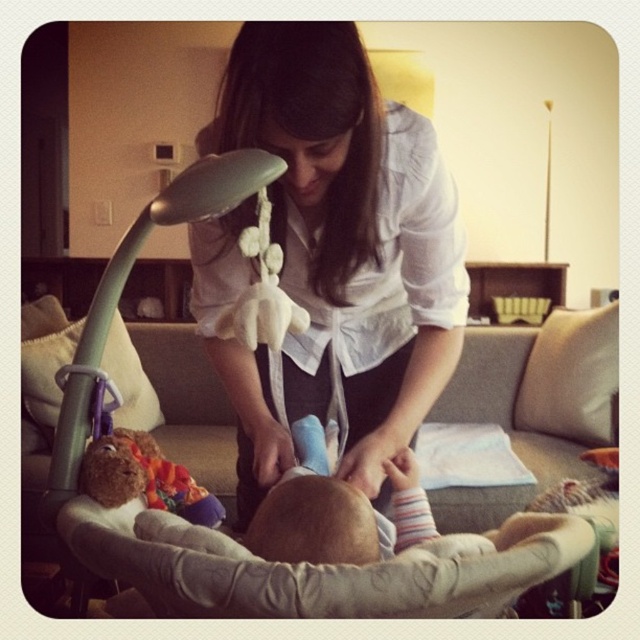
Question: Is white satin blouse at center thinner than gray fabric baby carriage at center?

Choices:
 (A) no
 (B) yes

Answer: (B)

Question: Is white satin blouse at center bigger than brown plush bear at lower left?

Choices:
 (A) yes
 (B) no

Answer: (A)

Question: Which of the following is the closest to the observer?

Choices:
 (A) brown plush bear at lower left
 (B) gray fabric baby carriage at center

Answer: (A)

Question: From the image, what is the correct spatial relationship of white satin blouse at center in relation to brown plush bear at lower left?

Choices:
 (A) left
 (B) right

Answer: (B)

Question: Which point appears closest to the camera in this image?

Choices:
 (A) (234, 86)
 (B) (189, 330)
 (C) (125, 445)

Answer: (C)

Question: Which is nearer to the gray fabric baby carriage at center?

Choices:
 (A) brown plush bear at lower left
 (B) white satin blouse at center

Answer: (B)